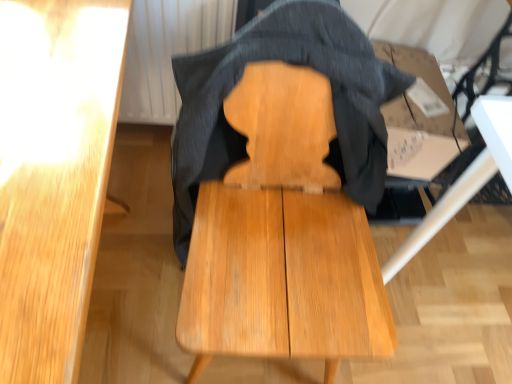
The height and width of the screenshot is (384, 512). What do you see at coordinates (282, 238) in the screenshot?
I see `wooden armchair at center` at bounding box center [282, 238].

Identify the location of wooden armchair at center. Image resolution: width=512 pixels, height=384 pixels. (282, 238).

Where is `wooden armchair at center`? wooden armchair at center is located at coordinates (282, 238).